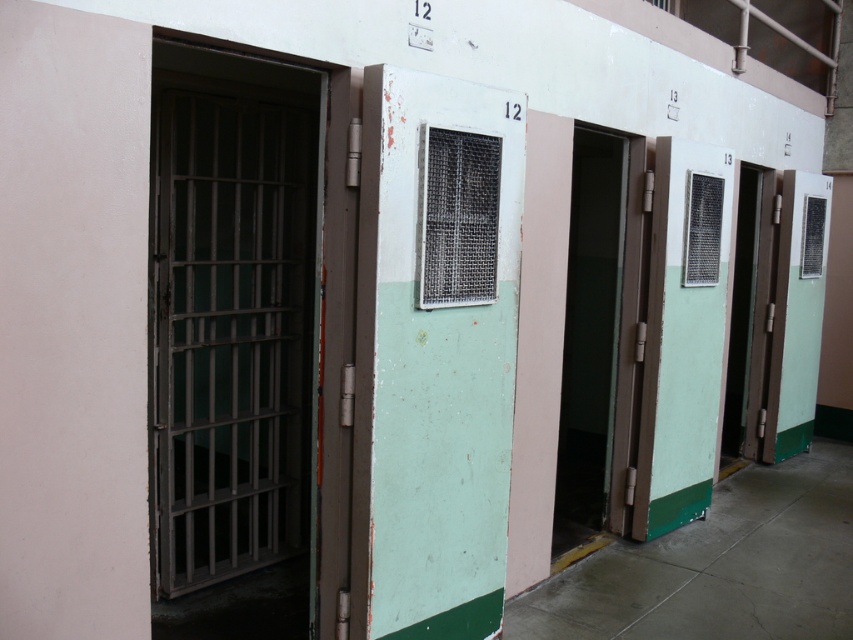
You are standing in the corridor of the prison cells and need to locate two specific points marked on a map. The first point is at coordinates point(x=177, y=397) and the second is at point(x=614, y=275). Which point is closer to you when facing the cells?

Point(x=177, y=397) is in front of point(x=614, y=275), so it is closer to you when facing the cells.

You are an inmate in cell 12 and need to reach the water fountain located outside your cell. The green matte door at center is your cell door. Can you step over the metallic gray bars at left to exit?

The metallic gray bars at left is not as tall as green matte door at center, so you can step over the metallic gray bars at left to exit.